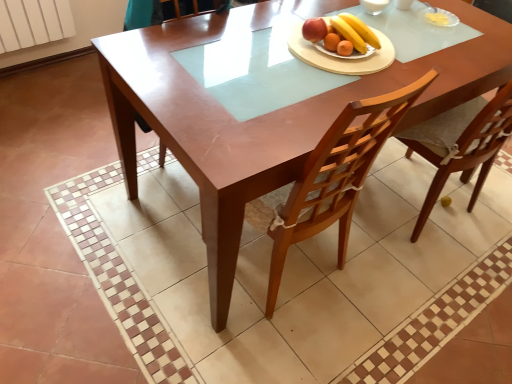
The width and height of the screenshot is (512, 384). I want to click on free space to the left of shiny white plate with fruits at center, so click(x=281, y=40).